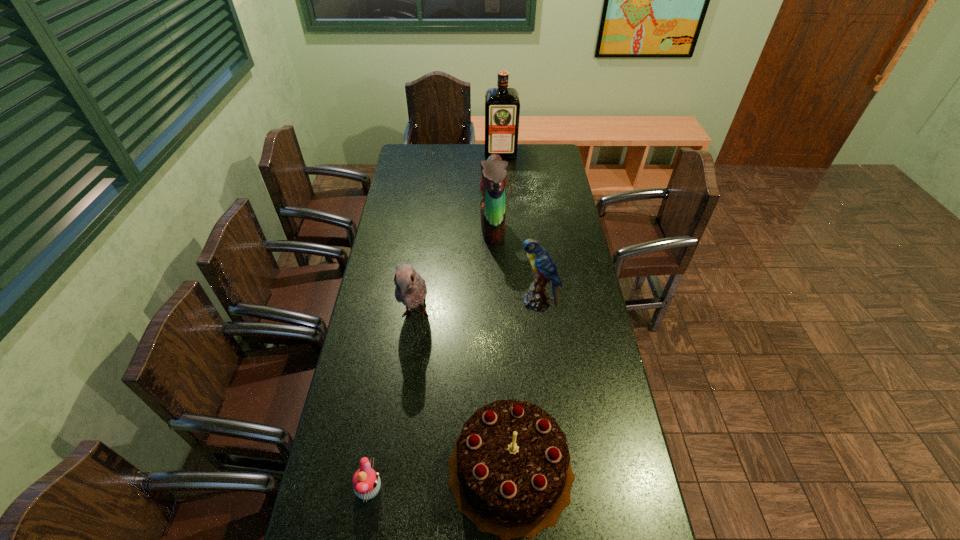
Image resolution: width=960 pixels, height=540 pixels. In the image, there is a desktop. In order to click on vacant region at the far edge in this screenshot , I will do `click(470, 151)`.

This screenshot has height=540, width=960. I want to click on vacant space at the left edge of the desktop, so click(x=351, y=390).

At what (x,y) coordinates should I click in order to perform the action: click on vacant space at the right edge of the desktop. Please return your answer as a coordinate pair (x, y). This screenshot has height=540, width=960. Looking at the image, I should click on click(573, 225).

I want to click on free spot at the far right corner of the desktop, so point(559,165).

At what (x,y) coordinates should I click in order to perform the action: click on free space that is in between the shortest object and the liquor. Please return your answer as a coordinate pair (x, y). Image resolution: width=960 pixels, height=540 pixels. Looking at the image, I should click on (435, 321).

Identify the location of vacant space that's between the leftmost parrot and the shortest object. (392, 402).

Image resolution: width=960 pixels, height=540 pixels. Find the location of `free space between the shortest object and the leftmost parrot`. free space between the shortest object and the leftmost parrot is located at coordinates (392, 402).

Locate an element on the screen. This screenshot has width=960, height=540. free space that is in between the leftmost parrot and the rightmost parrot is located at coordinates (476, 309).

You are a GUI agent. You are given a task and a screenshot of the screen. Output one action in this format:
    pyautogui.click(x=<x>, y=<y>)
    Task: Click on the free space between the shortest object and the leftmost parrot
    
    Given the screenshot: What is the action you would take?
    coord(392,402)

Find the location of a particular element. The image size is (960, 540). free space between the second farthest object and the leftmost parrot is located at coordinates (454, 272).